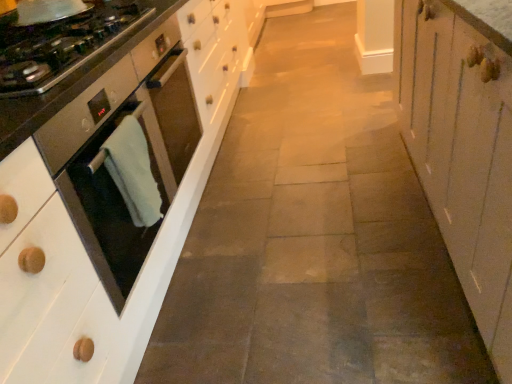
Question: Is satin steel oven at left far from green towel at left?

Choices:
 (A) yes
 (B) no

Answer: (B)

Question: Can you confirm if satin steel oven at left is positioned to the right of green towel at left?

Choices:
 (A) no
 (B) yes

Answer: (A)

Question: Does satin steel oven at left have a greater height compared to green towel at left?

Choices:
 (A) yes
 (B) no

Answer: (A)

Question: Does satin steel oven at left lie behind green towel at left?

Choices:
 (A) yes
 (B) no

Answer: (A)

Question: From the image's perspective, would you say satin steel oven at left is shown under green towel at left?

Choices:
 (A) yes
 (B) no

Answer: (B)

Question: Considering the relative sizes of satin steel oven at left and green towel at left in the image provided, is satin steel oven at left smaller than green towel at left?

Choices:
 (A) yes
 (B) no

Answer: (B)

Question: Can you confirm if white wood cabinet at right is thinner than green towel at left?

Choices:
 (A) no
 (B) yes

Answer: (A)

Question: From a real-world perspective, is white wood cabinet at right physically below green towel at left?

Choices:
 (A) no
 (B) yes

Answer: (B)

Question: Is white wood cabinet at right with green towel at left?

Choices:
 (A) yes
 (B) no

Answer: (B)

Question: Is white wood cabinet at right shorter than green towel at left?

Choices:
 (A) no
 (B) yes

Answer: (A)

Question: Considering the relative sizes of white wood cabinet at right and green towel at left in the image provided, is white wood cabinet at right wider than green towel at left?

Choices:
 (A) yes
 (B) no

Answer: (A)

Question: Can you confirm if white wood cabinet at right is positioned to the left of green towel at left?

Choices:
 (A) no
 (B) yes

Answer: (A)

Question: Is satin black oven at left positioned far away from green towel at left?

Choices:
 (A) no
 (B) yes

Answer: (A)